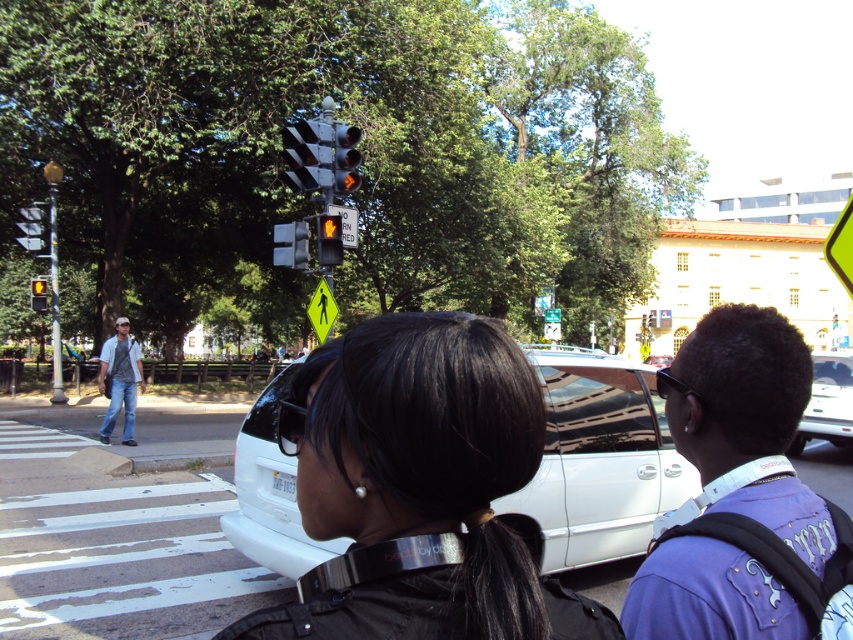
You are a pedestrian waiting at the crosswalk. You see the purple fabric shirt at center right and the yellow reflective pedestrian crossing sign at upper center. Which object is closer to the left side of the crosswalk?

The purple fabric shirt at center right is positioned on the left side of the yellow reflective pedestrian crossing sign at upper center, so it is closer to the left side of the crosswalk.

Consider the image. You are a pedestrian waiting at the crosswalk. You see the black matte hair at center and the denim jeans at left. Which one is positioned more to the left?

The denim jeans at left are positioned more to the left than the black matte hair at center.